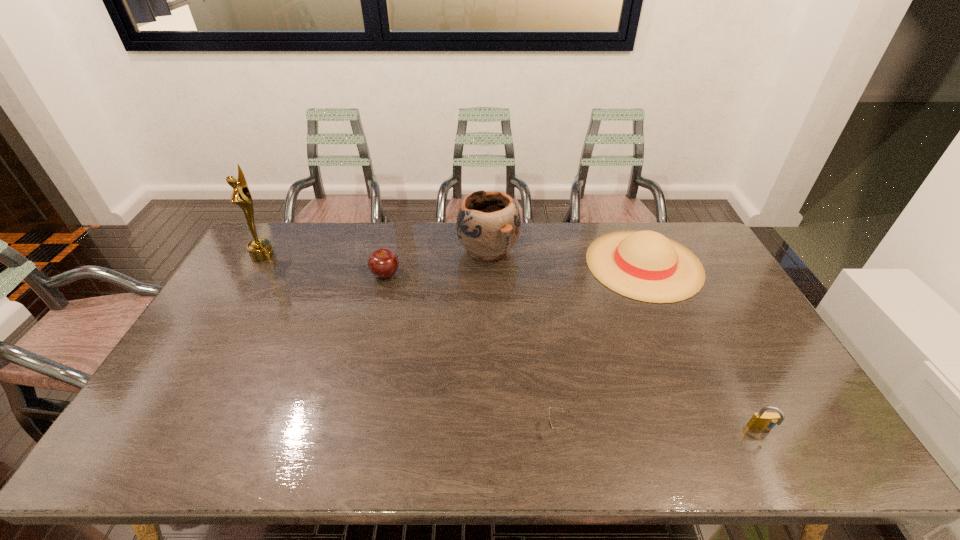
This screenshot has width=960, height=540. What are the coordinates of `vacant space at the right edge of the desktop` in the screenshot? It's located at (752, 377).

The height and width of the screenshot is (540, 960). In the image, there is a desktop. What are the coordinates of `vacant area at the far left corner` in the screenshot? It's located at (295, 235).

What are the coordinates of `vacant space that is in between the padlock and the apple` in the screenshot? It's located at (573, 352).

Find the location of a particular element. Image resolution: width=960 pixels, height=540 pixels. vacant space that is in between the fifth object from right to left and the shortest object is located at coordinates [x=471, y=352].

Locate an element on the screen. The image size is (960, 540). unoccupied position between the third object from left to right and the second object from left to right is located at coordinates (437, 262).

Where is `vacant area that lies between the award and the padlock`? The width and height of the screenshot is (960, 540). vacant area that lies between the award and the padlock is located at coordinates (512, 342).

Image resolution: width=960 pixels, height=540 pixels. Find the location of `unoccupied position between the apple and the fifth shortest object`. unoccupied position between the apple and the fifth shortest object is located at coordinates (437, 262).

Locate an element on the screen. This screenshot has height=540, width=960. free area in between the leftmost object and the sunglasses is located at coordinates (410, 342).

Where is `vacant space in between the tallest object and the apple`? vacant space in between the tallest object and the apple is located at coordinates (324, 265).

Find the location of a particular element. The height and width of the screenshot is (540, 960). empty location between the apple and the third object from left to right is located at coordinates (437, 262).